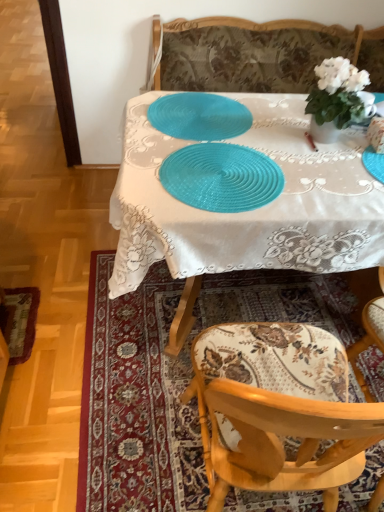
What is the approximate height of blue plastic placemat at center?

13.14 inches.

This screenshot has height=512, width=384. In order to click on blue plastic placemat at center in this screenshot , I will do `click(247, 211)`.

Measure the distance between point (194, 487) and camera.

Point (194, 487) is 4.34 feet away from camera.

Identify the location of wooden floral-patterned chair at lower right. The image size is (384, 512). (278, 409).

Is white glossy vase at upper right bigger or smaller than wooden floral-patterned chair at lower right?

white glossy vase at upper right is smaller than wooden floral-patterned chair at lower right.

In the scene shown: Is white glossy vase at upper right far away from wooden floral-patterned chair at lower right?

Actually, white glossy vase at upper right and wooden floral-patterned chair at lower right are a little close together.

From the image's perspective, is white glossy vase at upper right located above or below wooden floral-patterned chair at lower right?

white glossy vase at upper right is situated higher than wooden floral-patterned chair at lower right in the image.

Which is further, (326, 76) or (314, 342)?

Positioned behind is point (326, 76).

Considering the sizes of objects wooden chair at lower right and wooden floral-patterned chair at lower right in the image provided, who is wider, wooden chair at lower right or wooden floral-patterned chair at lower right?

wooden chair at lower right is wider.

Is wooden floral-patterned chair at lower right a part of wooden chair at lower right?

No, wooden floral-patterned chair at lower right is not inside wooden chair at lower right.

Which of these two, wooden chair at lower right or wooden floral-patterned chair at lower right, is bigger?

wooden chair at lower right.

You are a GUI agent. You are given a task and a screenshot of the screen. Output one action in this format:
    pyautogui.click(x=<x>, y=<y>)
    Task: Click on the chair on the right of wooden chair at lower right
    
    Given the screenshot: What is the action you would take?
    pyautogui.click(x=278, y=409)

From the picture: Could wooden chair at lower right be considered to be inside wooden floral-patterned chair at lower right?

Definitely not — wooden chair at lower right is not inside wooden floral-patterned chair at lower right.

Which is less distant, (294, 388) or (325, 317)?

The point (294, 388) is in front.

Looking at this image, is wooden floral-patterned chair at lower right taller or shorter than wooden chair at lower right?

wooden floral-patterned chair at lower right is taller than wooden chair at lower right.

Which of these two, teal woven placemat at center, marked as the 2th tableware in a top-to-bottom arrangement, or white glossy vase at upper right, is thinner?

white glossy vase at upper right.

Which is closer to the camera, (189, 175) or (320, 122)?

Point (189, 175) appears to be closer to the viewer than point (320, 122).

Starting from the white glossy vase at upper right, which tableware is the 1st one to the left? Please provide its 2D coordinates.

[(221, 177)]

How distant is teal woven placemat at center, marked as the 2th tableware in a top-to-bottom arrangement, from white glossy vase at upper right?

They are 15.11 inches apart.

From the picture: Which of these two, teal plastic placemat at center, which ranks as the 2th tableware in bottom-to-top order, or wooden chair at lower right, is wider?

Wider between the two is wooden chair at lower right.

Is teal plastic placemat at center, which is the second tableware in front-to-back order, positioned with its back to wooden chair at lower right?

teal plastic placemat at center, which is the second tableware in front-to-back order, does not have its back to wooden chair at lower right.

Are teal plastic placemat at center, which ranks as the first tableware in top-to-bottom order, and wooden chair at lower right far apart?

They are positioned close to each other.

How distant is teal plastic placemat at center, which ranks as the first tableware in top-to-bottom order, from wooden chair at lower right?

A distance of 32.33 inches exists between teal plastic placemat at center, which ranks as the first tableware in top-to-bottom order, and wooden chair at lower right.

Can teal plastic placemat at center, which is the second tableware in front-to-back order, be found inside teal woven placemat at center, arranged as the first tableware when viewed from the front?

No.

Who is bigger, teal woven placemat at center, the second tableware viewed from the back, or teal plastic placemat at center, which ranks as the 2th tableware in bottom-to-top order?

Bigger between the two is teal woven placemat at center, the second tableware viewed from the back.

In the scene shown: Does teal woven placemat at center, marked as the 2th tableware in a top-to-bottom arrangement, appear on the left side of teal plastic placemat at center, which is the second tableware in front-to-back order?

Incorrect, teal woven placemat at center, marked as the 2th tableware in a top-to-bottom arrangement, is not on the left side of teal plastic placemat at center, which is the second tableware in front-to-back order.

Which is in front, teal woven placemat at center, the second tableware viewed from the back, or teal plastic placemat at center, placed as the first tableware when sorted from back to front?

Positioned in front is teal woven placemat at center, the second tableware viewed from the back.

I want to click on the 2nd tableware behind the wooden floral-patterned chair at lower right, so click(x=199, y=116).

Is wooden floral-patterned chair at lower right further to the viewer compared to teal plastic placemat at center, which ranks as the 2th tableware in bottom-to-top order?

No, it is not.

From a real-world perspective, is wooden floral-patterned chair at lower right positioned under teal plastic placemat at center, placed as the first tableware when sorted from back to front, based on gravity?

Yes, from a real-world perspective, wooden floral-patterned chair at lower right is beneath teal plastic placemat at center, placed as the first tableware when sorted from back to front.

From the image's perspective, which one is positioned lower, wooden floral-patterned chair at lower right or teal plastic placemat at center, which ranks as the first tableware in top-to-bottom order?

wooden floral-patterned chair at lower right.

You are a GUI agent. You are given a task and a screenshot of the screen. Output one action in this format:
    pyautogui.click(x=<x>, y=<y>)
    Task: Click on the houseplant above the wooden floral-patterned chair at lower right (from a real-world perspective)
    
    Given the screenshot: What is the action you would take?
    pyautogui.click(x=336, y=99)

The image size is (384, 512). In order to click on chair on the right of wooden chair at lower right in this screenshot , I will do `click(278, 409)`.

Considering their positions, is blue plastic placemat at center positioned closer to teal woven placemat at center, the second tableware viewed from the back, than teal plastic placemat at center, placed as the first tableware when sorted from back to front?

blue plastic placemat at center lies closer to teal woven placemat at center, the second tableware viewed from the back, than the other object.

Which object lies nearer to the anchor point teal woven placemat at center, marked as the 2th tableware in a top-to-bottom arrangement, white glossy vase at upper right or wooden floral-patterned chair at lower right?

white glossy vase at upper right is positioned closer to the anchor teal woven placemat at center, marked as the 2th tableware in a top-to-bottom arrangement.

Considering their positions, is blue plastic placemat at center positioned closer to teal plastic placemat at center, which is the second tableware in front-to-back order, than teal woven placemat at center, arranged as the first tableware when viewed from the front?

blue plastic placemat at center is positioned closer to the anchor teal plastic placemat at center, which is the second tableware in front-to-back order.

Based on their spatial positions, is white glossy vase at upper right or teal plastic placemat at center, which ranks as the 2th tableware in bottom-to-top order, closer to teal woven placemat at center, acting as the first tableware starting from the bottom?

teal plastic placemat at center, which ranks as the 2th tableware in bottom-to-top order, lies closer to teal woven placemat at center, acting as the first tableware starting from the bottom, than the other object.

Looking at the image, which one is located closer to wooden chair at lower right, teal plastic placemat at center, which is the second tableware in front-to-back order, or wooden floral-patterned chair at lower right?

wooden floral-patterned chair at lower right.

Looking at the image, which one is located closer to blue plastic placemat at center, teal plastic placemat at center, placed as the first tableware when sorted from back to front, or white glossy vase at upper right?

teal plastic placemat at center, placed as the first tableware when sorted from back to front, lies closer to blue plastic placemat at center than the other object.

Considering their positions, is wooden floral-patterned chair at lower right positioned closer to wooden chair at lower right than blue plastic placemat at center?

wooden floral-patterned chair at lower right is positioned closer to the anchor wooden chair at lower right.

Considering their positions, is teal woven placemat at center, acting as the first tableware starting from the bottom, positioned further to wooden chair at lower right than wooden floral-patterned chair at lower right?

Among the two, teal woven placemat at center, acting as the first tableware starting from the bottom, is located further to wooden chair at lower right.

Find the location of a particular element. The width and height of the screenshot is (384, 512). tableware between teal plastic placemat at center, which ranks as the first tableware in top-to-bottom order, and white glossy vase at upper right is located at coordinates (221, 177).

You are a GUI agent. You are given a task and a screenshot of the screen. Output one action in this format:
    pyautogui.click(x=<x>, y=<y>)
    Task: Click on the tableware between blue plastic placemat at center and wooden floral-patterned chair at lower right from top to bottom
    This screenshot has width=384, height=512.
    Given the screenshot: What is the action you would take?
    pyautogui.click(x=221, y=177)

This screenshot has width=384, height=512. I want to click on chair that lies between blue plastic placemat at center and wooden chair at lower right from top to bottom, so click(x=278, y=409).

Locate an element on the screen. This screenshot has width=384, height=512. chair that lies between teal plastic placemat at center, placed as the first tableware when sorted from back to front, and wooden chair at lower right from top to bottom is located at coordinates (278, 409).